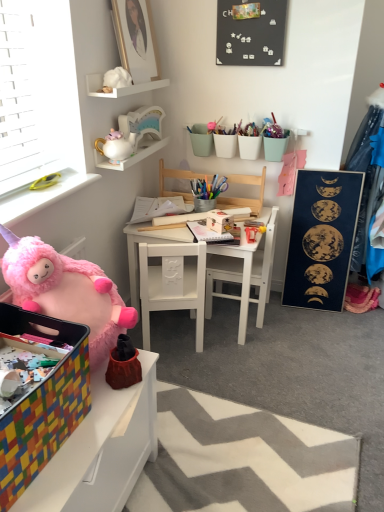
Question: Is white matte shelf at upper center, placed as the first shelf when sorted from top to bottom, spatially inside white matte table at center, the 2th table when ordered from bottom to top, or outside of it?

Choices:
 (A) inside
 (B) outside

Answer: (B)

Question: From a real-world perspective, relative to white matte table at center, the 1th table positioned from the top, is white matte shelf at upper center, placed as the first shelf when sorted from top to bottom, vertically above or below?

Choices:
 (A) above
 (B) below

Answer: (A)

Question: Based on their relative distances, which object is farther from the white matte chair at center, which is the second chair in top-to-bottom order?

Choices:
 (A) multicolored plastic box at lower left
 (B) white ceramic teapot at upper left, the 2th shelf in the top-to-bottom sequence
 (C) fluffy pink plush at lower left, positioned as the third toy in top-to-bottom order
 (D) white matte chair at center, which is the 3th chair from top to bottom
 (E) white glossy teapot at upper center, the 2th toy when ordered from top to bottom

Answer: (A)

Question: Considering the real-world distances, which object is farthest from the white ceramic teapot at upper left, the 2th shelf in the top-to-bottom sequence?

Choices:
 (A) white glossy teapot at upper center, the 2th toy when ordered from top to bottom
 (B) white matte shelf at upper center, the 2th shelf from the bottom
 (C) wooden chair at center, which appears as the third chair when ordered from the bottom
 (D) white fabric doll at upper center, arranged as the third toy when ordered from the bottom
 (E) dark blue matte poster at right, the 1th bulletin board ordered from the bottom

Answer: (E)